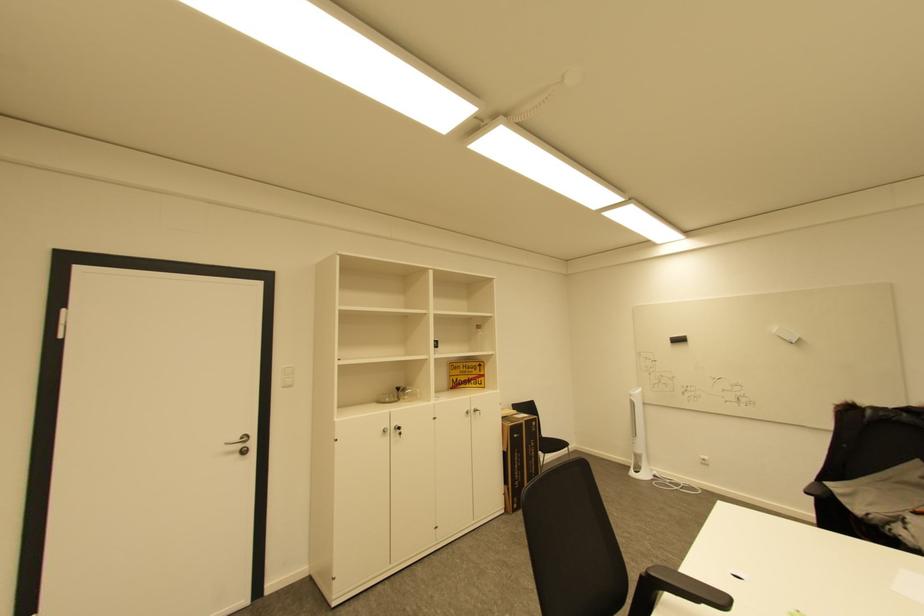
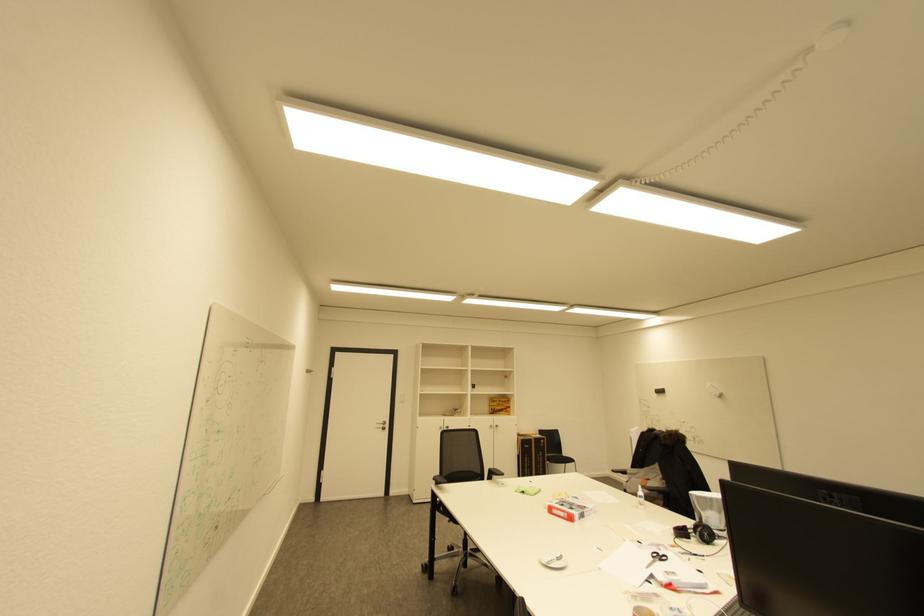
Where in the second image is the point corresponding to the point at 237,453 from the first image?

(385, 429)